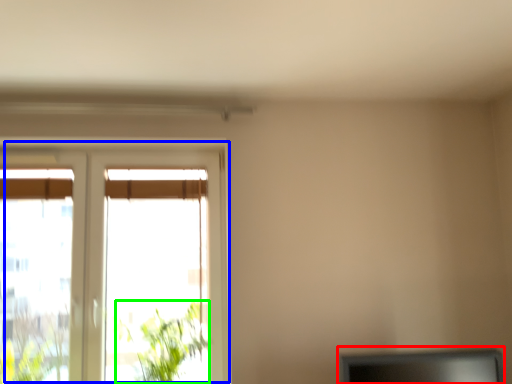
Question: Which object is the closest to the computer monitor (highlighted by a red box)? Choose among these: window (highlighted by a blue box) or plant (highlighted by a green box).

Choices:
 (A) window
 (B) plant

Answer: (B)